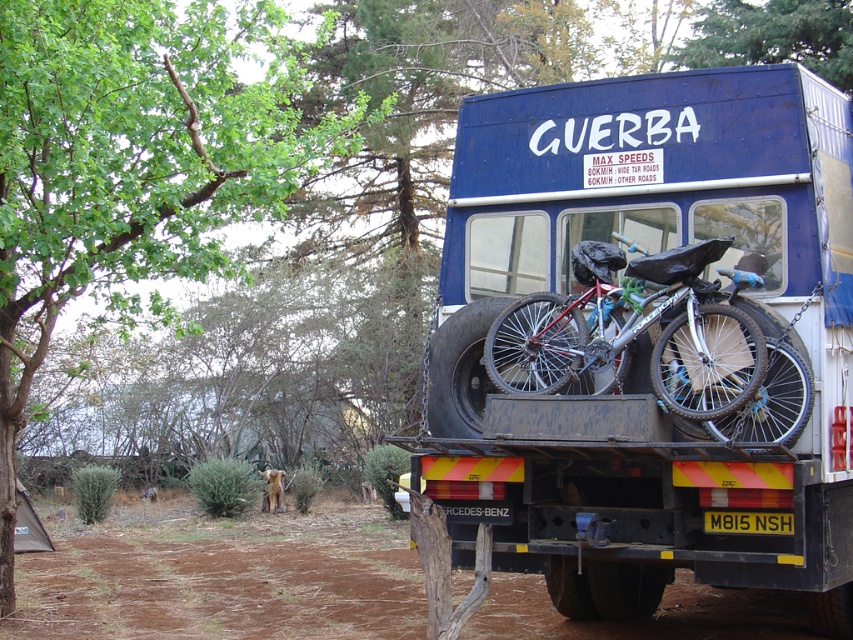
Does blue matte trailer truck at center lie behind silver metallic bicycle at center?

No, blue matte trailer truck at center is in front of silver metallic bicycle at center.

Between blue matte trailer truck at center and silver metallic bicycle at center, which one appears on the right side from the viewer's perspective?

From the viewer's perspective, blue matte trailer truck at center appears more on the right side.

Between point (456, 164) and point (599, 241), which one is positioned in front?

Point (599, 241) is more forward.

Locate an element on the screen. The height and width of the screenshot is (640, 853). blue matte trailer truck at center is located at coordinates [x=653, y=337].